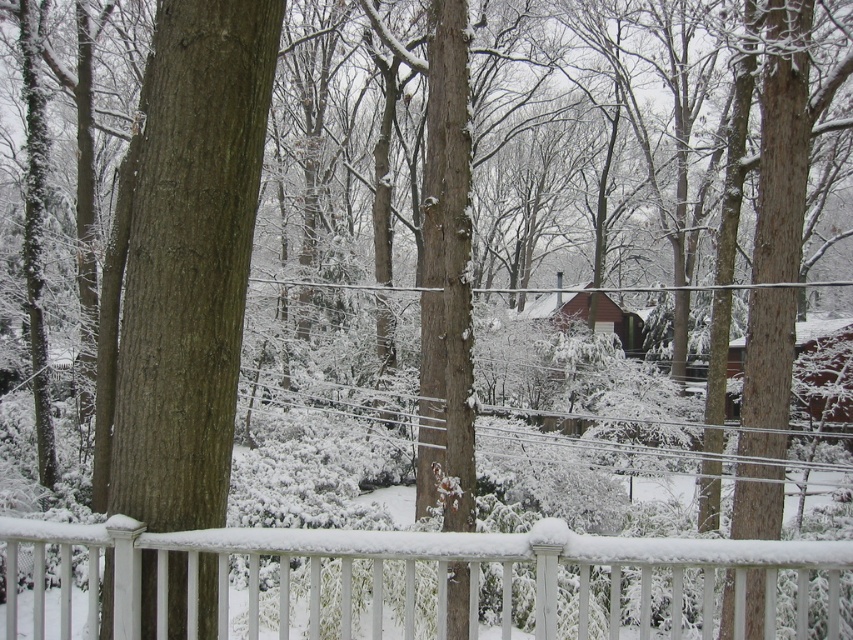
Question: Among these objects, which one is farthest from the camera?

Choices:
 (A) white painted wood rail at lower center
 (B) brown rough bark tree at left

Answer: (B)

Question: Is white painted wood rail at lower center behind brown rough bark tree at left?

Choices:
 (A) yes
 (B) no

Answer: (B)

Question: Can you confirm if white painted wood rail at lower center is positioned below brown rough bark tree at left?

Choices:
 (A) no
 (B) yes

Answer: (B)

Question: Does white painted wood rail at lower center have a larger size compared to brown rough bark tree at left?

Choices:
 (A) no
 (B) yes

Answer: (B)

Question: Which object is closer to the camera taking this photo?

Choices:
 (A) brown rough bark tree at left
 (B) white painted wood rail at lower center

Answer: (B)